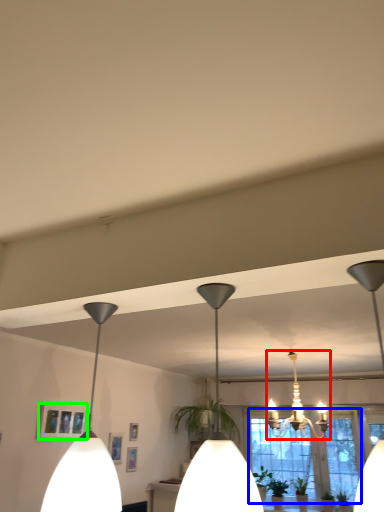
Question: Which is farther away from lamp (highlighted by a red box)? window (highlighted by a blue box) or picture frame (highlighted by a green box)?

Choices:
 (A) window
 (B) picture frame

Answer: (B)